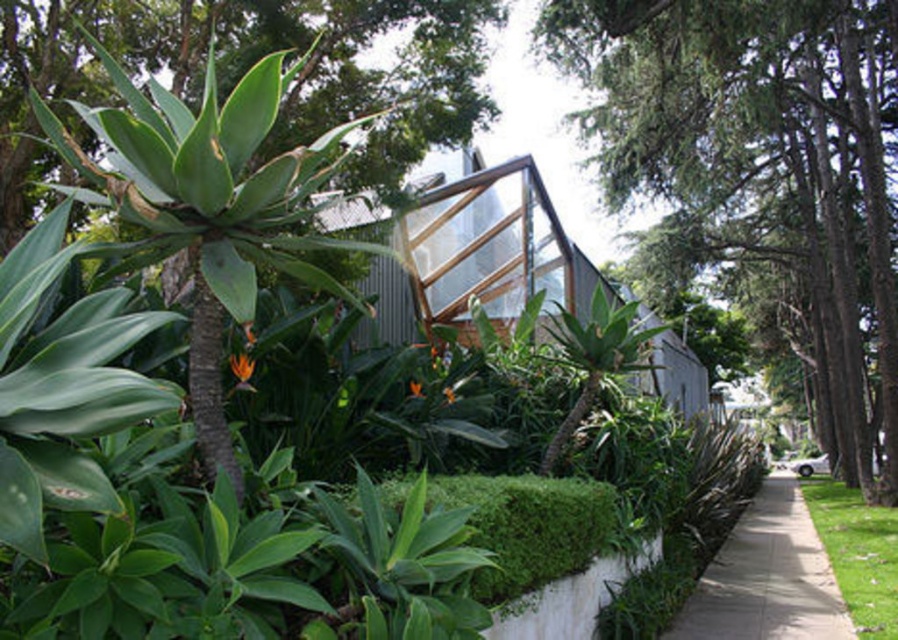
Question: Does green leafy tree at center appear under green leafy plant at center?

Choices:
 (A) no
 (B) yes

Answer: (A)

Question: Can you confirm if green leafy tree at center is positioned to the right of green grass at lower right?

Choices:
 (A) yes
 (B) no

Answer: (A)

Question: Among these objects, which one is farthest from the camera?

Choices:
 (A) gray concrete sidewalk at lower right
 (B) green leafy plant at center

Answer: (A)

Question: Estimate the real-world distances between objects in this image. Which object is closer to the green grass at lower right?

Choices:
 (A) green leafy plant at center
 (B) green leafy tree at center

Answer: (A)

Question: Which object is the farthest from the gray concrete sidewalk at lower right?

Choices:
 (A) green leafy plant at center
 (B) green grass at lower right

Answer: (A)

Question: Is gray concrete sidewalk at lower right to the right of green grass at lower right from the viewer's perspective?

Choices:
 (A) yes
 (B) no

Answer: (B)